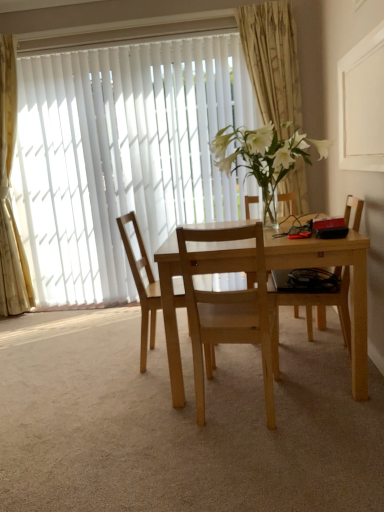
Where is `free area in between light wood chair at center, which is the second chair in right-to-left order, and light wood table at center`? This screenshot has width=384, height=512. free area in between light wood chair at center, which is the second chair in right-to-left order, and light wood table at center is located at coordinates (313, 412).